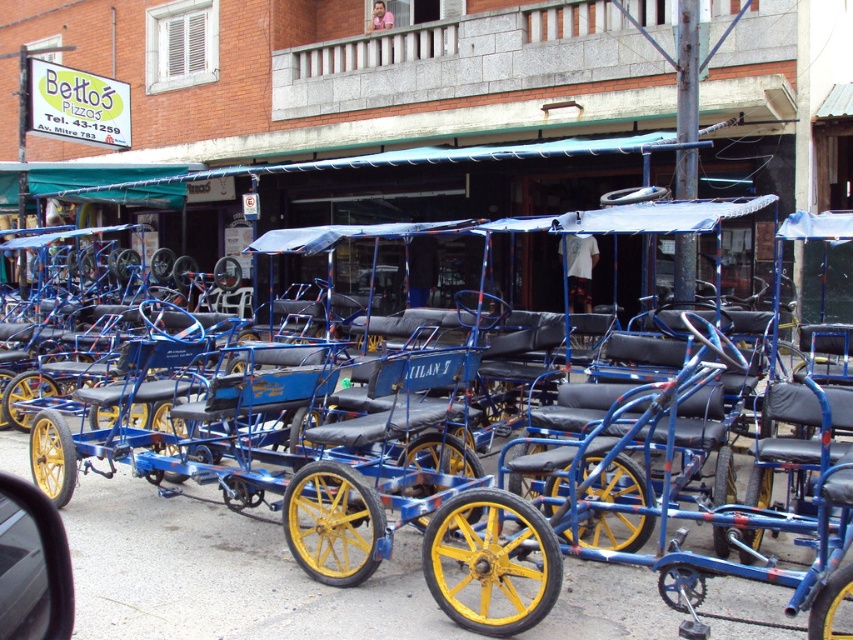
Question: Which point is farther to the camera?

Choices:
 (A) metallic blue tricycle at center
 (B) metallic blue car at lower left

Answer: (A)

Question: Does metallic blue tricycle at center appear under metallic blue car at lower left?

Choices:
 (A) yes
 (B) no

Answer: (B)

Question: Can you confirm if metallic blue tricycle at center is wider than metallic blue car at lower left?

Choices:
 (A) no
 (B) yes

Answer: (B)

Question: Which point is farther from the camera taking this photo?

Choices:
 (A) (317, 396)
 (B) (44, 552)

Answer: (A)

Question: Does metallic blue tricycle at center have a smaller size compared to metallic blue car at lower left?

Choices:
 (A) no
 (B) yes

Answer: (A)